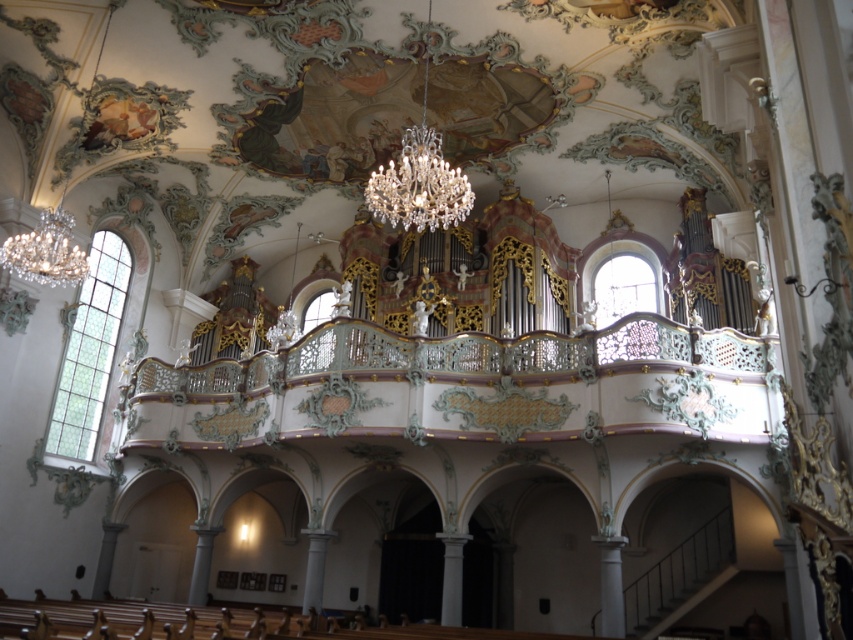
You are standing in the grand church and want to locate the pastel green ornate balcony at center. According to the coordinates provided, where should you look relative to the organ?

The pastel green ornate balcony at center is located at coordinates point (468,387), which is to the right and slightly above the organ.

You are an interior designer planning to install a new lighting fixture above the pastel green ornate balcony at center. The crystal glass chandelier at upper center is already present. Is there enough vertical space between the balcony and the chandelier to hang your new fixture?

The pastel green ornate balcony at center is positioned under the crystal glass chandelier at upper center, so there is vertical space between them. However, the exact amount of space isn

You are a visitor standing at the entrance of the church and want to take a photo of the pastel green ornate balcony at center and the crystal glass chandelier at upper center. If your camera can only focus on objects within 50 feet, will both objects be in focus?

The pastel green ornate balcony at center is 65.78 feet away from the crystal glass chandelier at upper center. Since the camera can only focus within 50 feet, both objects are beyond the focus range and cannot be captured in focus.